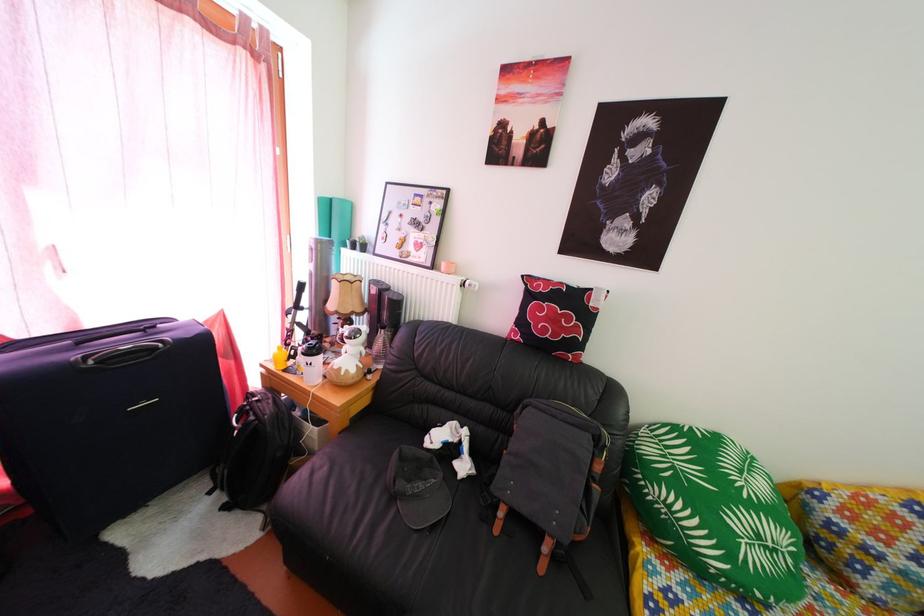
Where would you lift the black baseball cap? Please return your answer as a coordinate pair (x, y).

(418, 487)